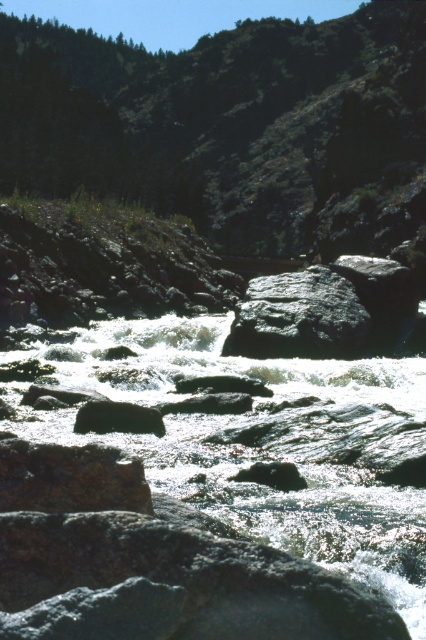
Looking at the green grassy hillside at upper center and the white frothy water at center, which one appears wider from your viewpoint?

The green grassy hillside at upper center appears wider than the white frothy water at center because its width is larger according to the description.

You are standing at point (163, 468) and want to cross the river to reach point (265, 131). Given the river has strong currents and submerged rocks, which direction should you move to get closer to your destination without entering the river?

You should move towards point (265, 131), which is behind point (163, 468). Since point (265, 131) is behind point (163, 468), moving in that direction would keep you on the riverbank closer to your destination without entering the dangerous currents.